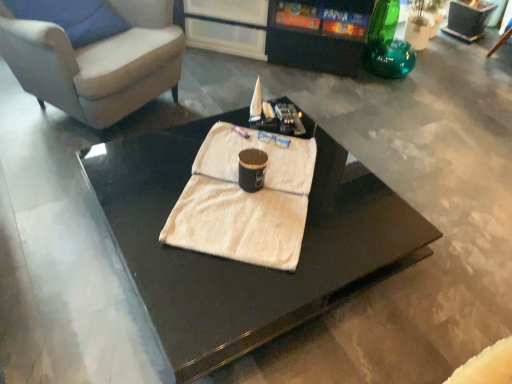
The height and width of the screenshot is (384, 512). I want to click on blank space to the left of white textured towel at center, so click(142, 200).